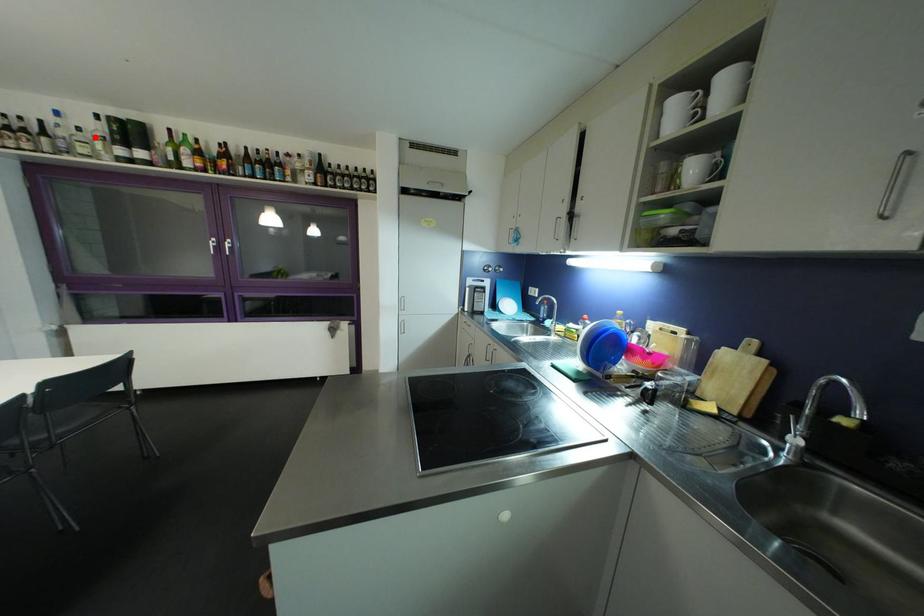
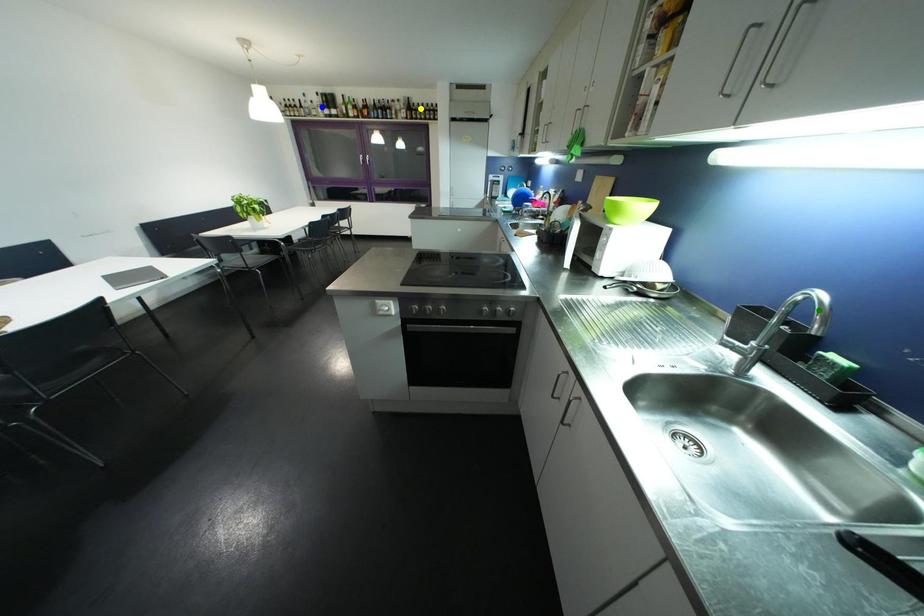
Question: I am providing you with two images of the same scene from different viewpoints. A red point is marked on the first image. You are given multiple points on the second image. Which point in image 2 is actually the same real-world point as the red point in image 1?

Choices:
 (A) yellow point
 (B) green point
 (C) blue point

Answer: (C)